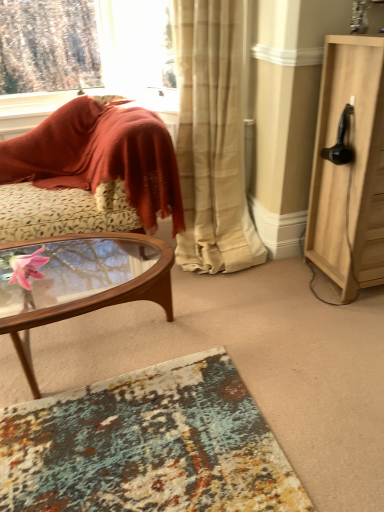
Question: From the image's perspective, relative to textured rug at lower center, is velvet-like rust-colored cushion at left above or below?

Choices:
 (A) below
 (B) above

Answer: (B)

Question: Based on their sizes in the image, would you say velvet-like rust-colored cushion at left is bigger or smaller than textured rug at lower center?

Choices:
 (A) big
 (B) small

Answer: (A)

Question: Estimate the real-world distances between objects in this image. Which object is closer to the beige sheer curtain at center?

Choices:
 (A) velvet-like rust-colored cushion at left
 (B) light wood cabinet at right
 (C) woodenwoodencoffee table at left
 (D) textured rug at lower center

Answer: (A)

Question: Estimate the real-world distances between objects in this image. Which object is closer to the beige sheer curtain at center?

Choices:
 (A) velvet-like rust-colored cushion at left
 (B) woodenwoodencoffee table at left
 (C) light wood cabinet at right
 (D) textured rug at lower center

Answer: (A)